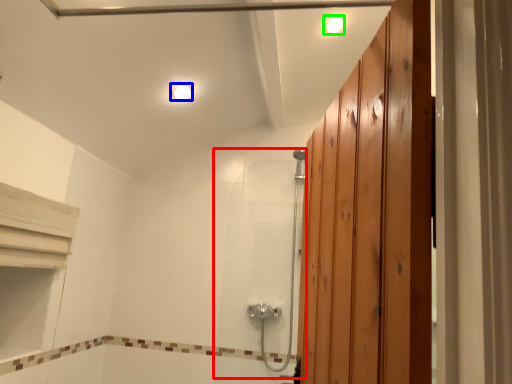
Question: Which object is positioned closest to shower door (highlighted by a red box)? Select from light fixture (highlighted by a blue box) and light fixture (highlighted by a green box).

Choices:
 (A) light fixture
 (B) light fixture

Answer: (A)